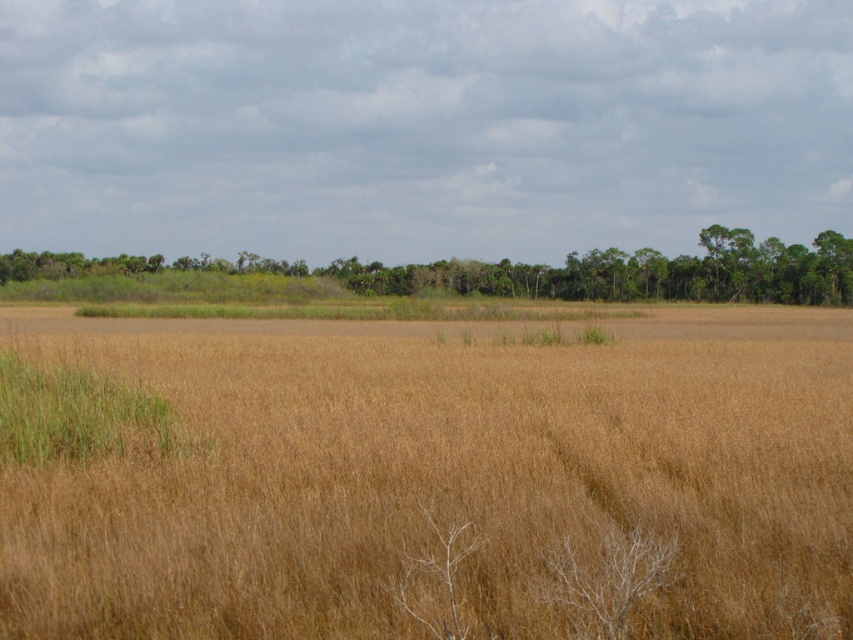
Question: Is brown grassland at center above green leafy trees at center?

Choices:
 (A) no
 (B) yes

Answer: (A)

Question: Is the position of brown grassland at center more distant than that of green leafy trees at center?

Choices:
 (A) no
 (B) yes

Answer: (A)

Question: Can you confirm if brown grassland at center is thinner than green leafy trees at center?

Choices:
 (A) no
 (B) yes

Answer: (B)

Question: Which point is closer to the camera?

Choices:
 (A) green leafy trees at center
 (B) brown grassland at center

Answer: (B)

Question: Which object appears farthest from the camera in this image?

Choices:
 (A) green leafy trees at center
 (B) brown grassland at center

Answer: (A)